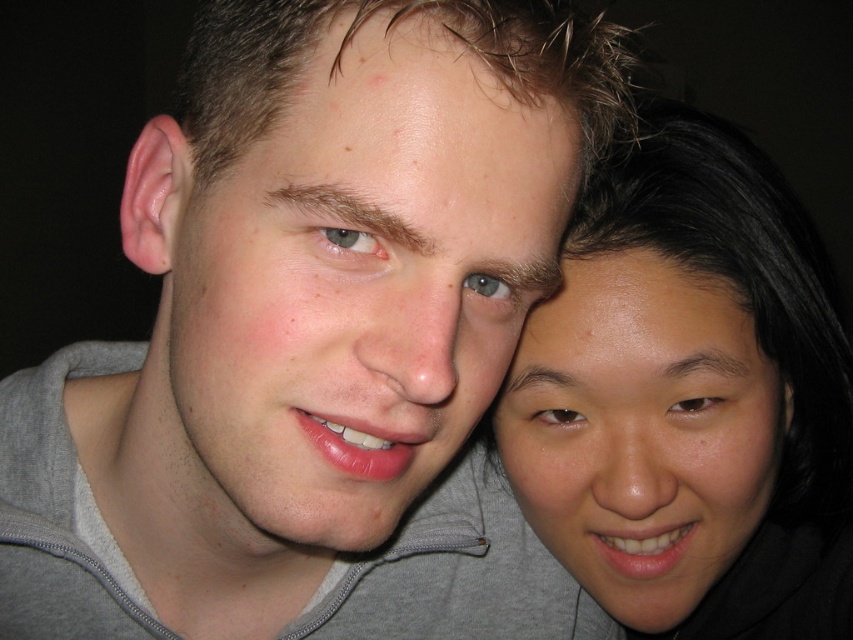
What are the exact coordinates of the matte gray hoodie at center?

The matte gray hoodie at center is located at point (358, 285).

You are a photographer trying to focus on the smooth skin face at right and the matte gray hoodie at center. Which object is nearer to your camera lens?

The matte gray hoodie at center is closer to the viewer than the smooth skin face at right, so the matte gray hoodie at center would be nearer to the camera lens.